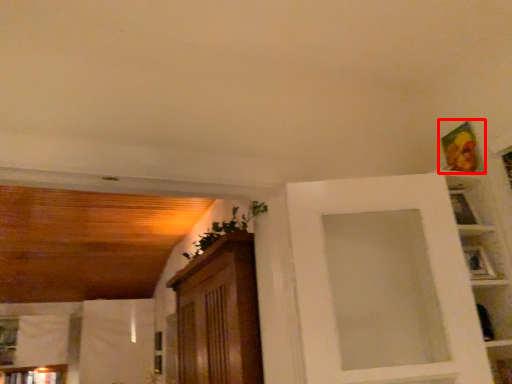
Question: In this image, where is picture frame (annotated by the red box) located relative to picture frame?

Choices:
 (A) left
 (B) right

Answer: (B)